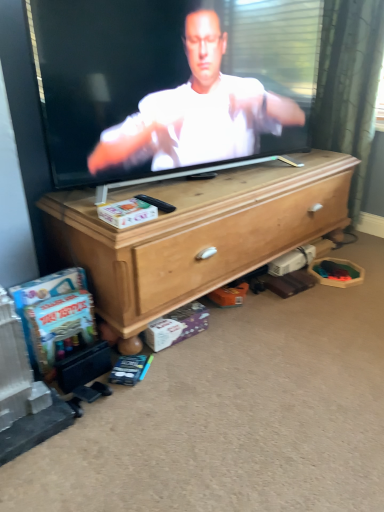
Image resolution: width=384 pixels, height=512 pixels. In order to click on free space behind black plastic remote control at center in this screenshot , I will do `click(165, 193)`.